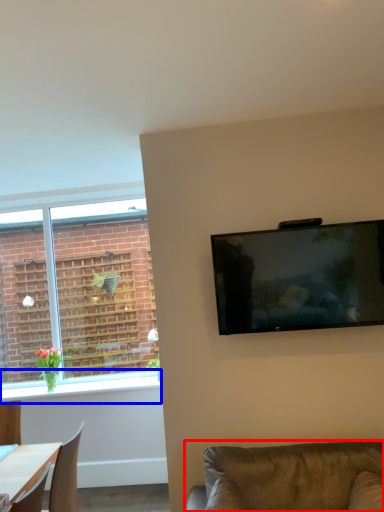
Question: Which of the following is the closest to the observer, studio couch (highlighted by a red box) or window sill (highlighted by a blue box)?

Choices:
 (A) studio couch
 (B) window sill

Answer: (A)